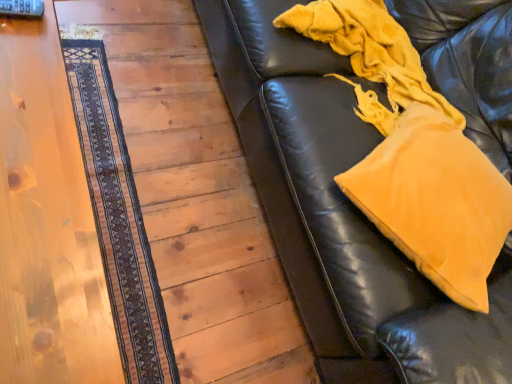
You are a GUI agent. You are given a task and a screenshot of the screen. Output one action in this format:
    pyautogui.click(x=<x>, y=<y>)
    Task: Click on the spots to the right of dark brown woven mat at left
    
    Given the screenshot: What is the action you would take?
    pyautogui.click(x=207, y=262)